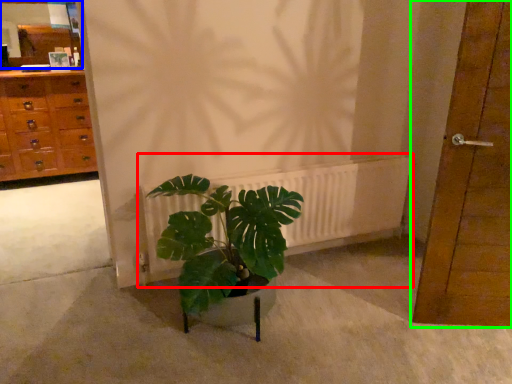
Question: Which is nearer to the radiator (highlighted by a red box)? mirror (highlighted by a blue box) or door (highlighted by a green box).

Choices:
 (A) mirror
 (B) door

Answer: (B)